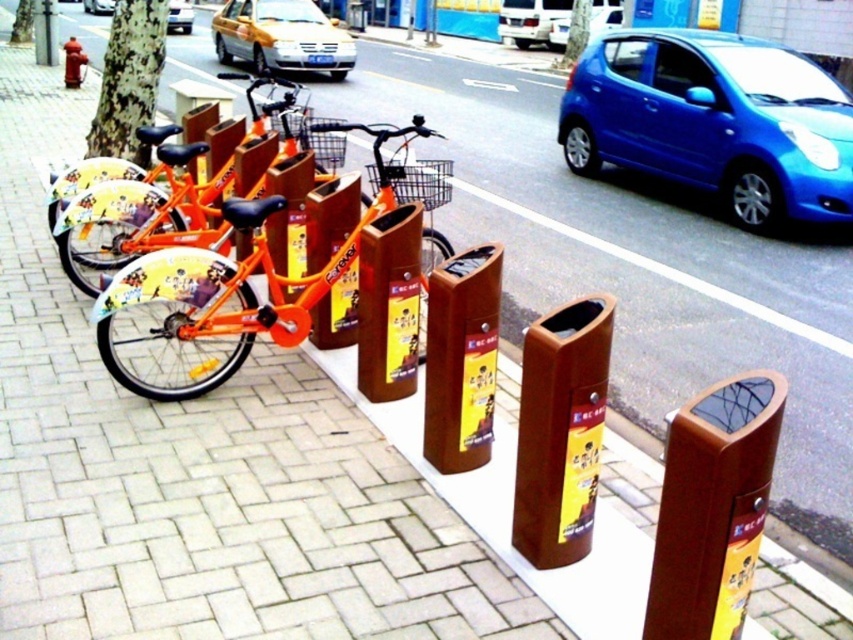
Question: Which point is closer to the camera?

Choices:
 (A) (722, 621)
 (B) (668, 120)

Answer: (A)

Question: Is yellow metallic taxi at upper center thinner than metallic gold car at center?

Choices:
 (A) yes
 (B) no

Answer: (B)

Question: Which point is farther from the camera taking this photo?

Choices:
 (A) (177, 26)
 (B) (233, 51)

Answer: (A)

Question: Can you confirm if yellow metallic taxi at upper center is positioned above metallic gold car at center?

Choices:
 (A) no
 (B) yes

Answer: (A)

Question: In this image, where is wooden trash can at center located relative to yellow metallic taxi at upper center?

Choices:
 (A) above
 (B) below

Answer: (B)

Question: Which object is farther from the camera taking this photo?

Choices:
 (A) wooden trash can at center
 (B) metallic silver car at upper center

Answer: (B)